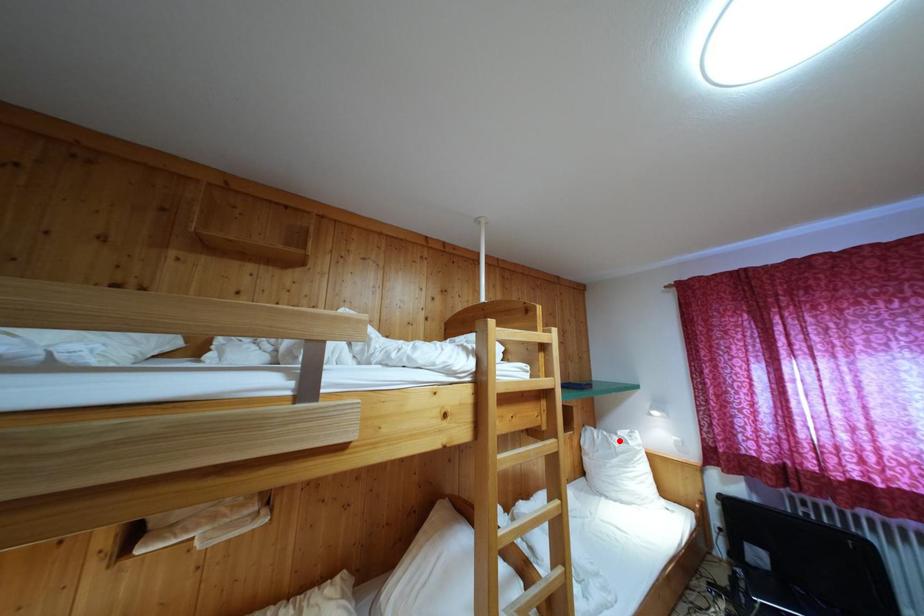
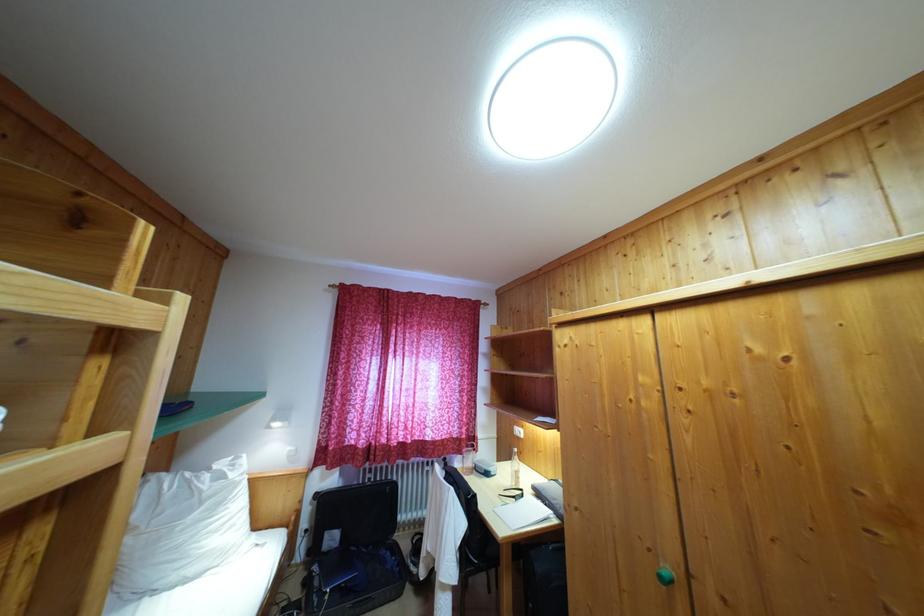
The point at the highlighted location is marked in the first image. Where is the corresponding point in the second image?

(213, 476)